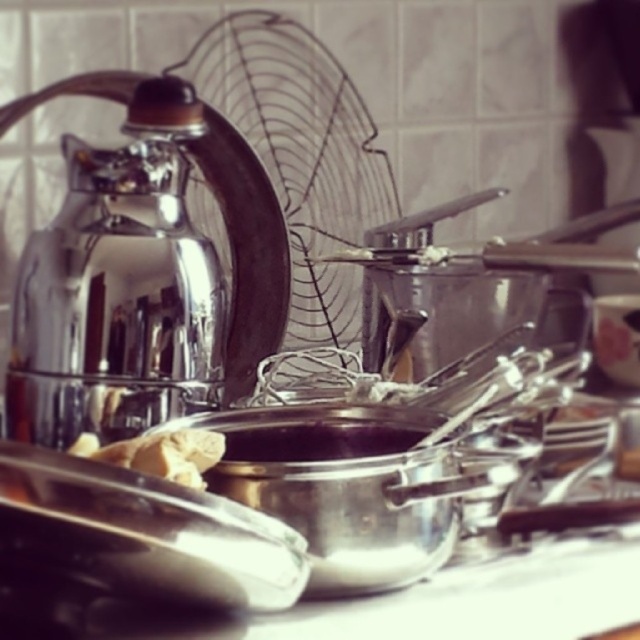
Can you confirm if shiny metallic kettle at left is wider than white crumbly dough at center?

Indeed, shiny metallic kettle at left has a greater width compared to white crumbly dough at center.

This screenshot has height=640, width=640. Describe the element at coordinates (141, 268) in the screenshot. I see `shiny metallic kettle at left` at that location.

Between point (115, 186) and point (196, 458), which one is positioned in front?

Point (196, 458)

Identify the location of shiny metallic kettle at left. This screenshot has width=640, height=640. (141, 268).